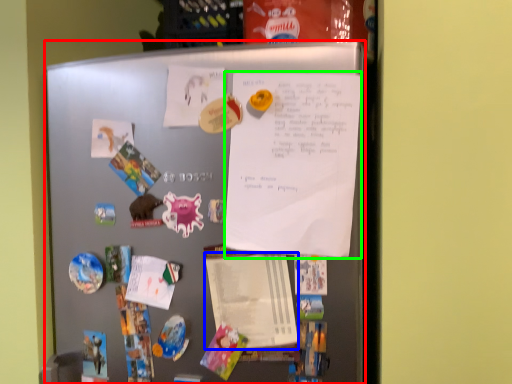
Question: Estimate the real-world distances between objects in this image. Which object is farther from refrigerator (highlighted by a red box), notepad (highlighted by a blue box) or poster (highlighted by a green box)?

Choices:
 (A) notepad
 (B) poster

Answer: (A)